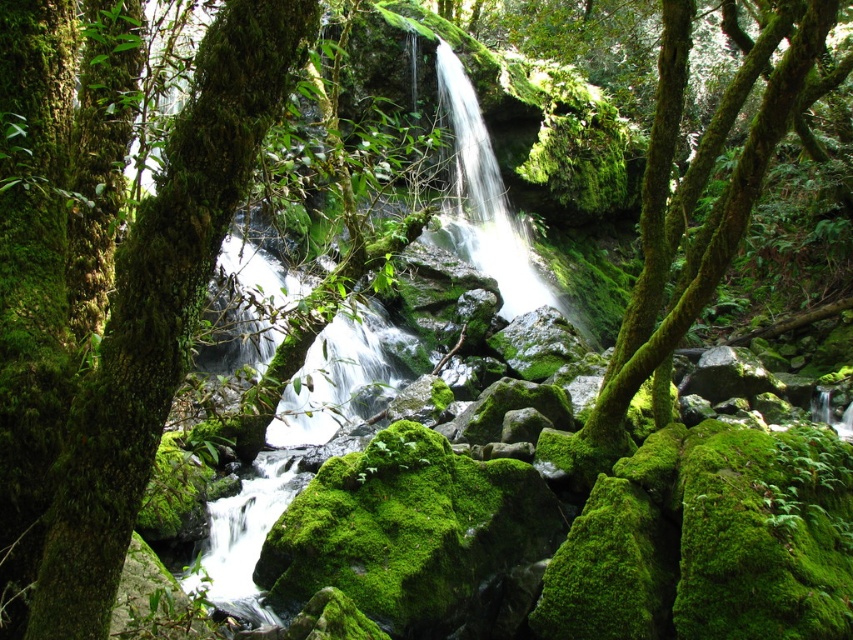
Between green mossy tree at center and white frothy water at center, which one is positioned higher?

Positioned higher is green mossy tree at center.

Who is more distant from viewer, (595, 451) or (463, 161)?

Point (463, 161)

Image resolution: width=853 pixels, height=640 pixels. What are the coordinates of `green mossy tree at center` in the screenshot? It's located at (679, 236).

Image resolution: width=853 pixels, height=640 pixels. Describe the element at coordinates (161, 307) in the screenshot. I see `green mossy tree at left` at that location.

Does green mossy tree at left have a smaller size compared to green mossy tree at center?

No.

Between point (105, 492) and point (641, 321), which one is positioned behind?

The point (641, 321) is behind.

This screenshot has height=640, width=853. Identify the location of green mossy tree at left. (161, 307).

Is green mossy tree at left to the left of white frothy water at center from the viewer's perspective?

Yes, green mossy tree at left is to the left of white frothy water at center.

The image size is (853, 640). What do you see at coordinates (161, 307) in the screenshot?
I see `green mossy tree at left` at bounding box center [161, 307].

Find the location of a particular element. green mossy tree at left is located at coordinates (161, 307).